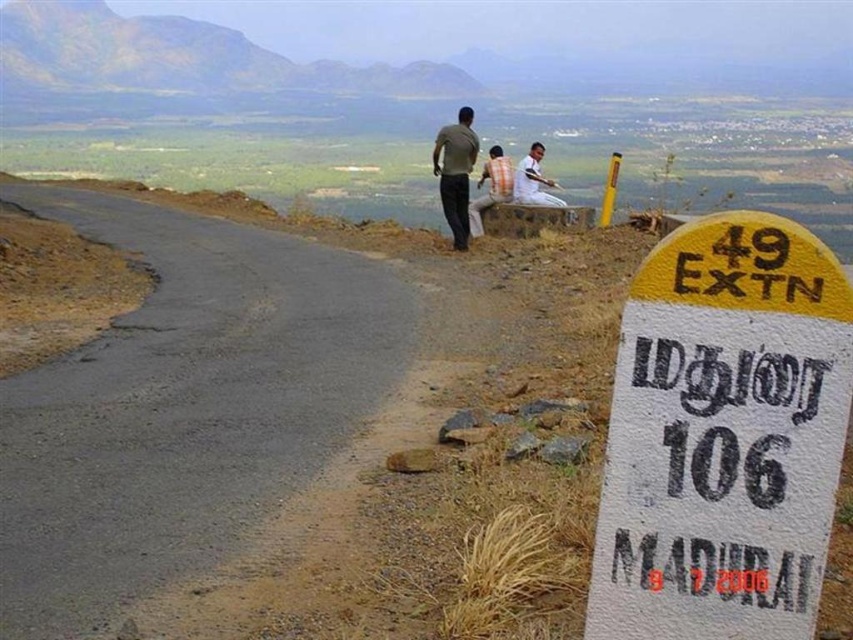
Question: Is black asphalt road at left further to the viewer compared to dark gray shirt at upper center?

Choices:
 (A) yes
 (B) no

Answer: (B)

Question: Which object is positioned closest to the orange striped shirt at center?

Choices:
 (A) black asphalt road at left
 (B) white painted stone sign at right
 (C) light brown wooden stick at upper center
 (D) dark gray shirt at upper center

Answer: (D)

Question: Which of the following is the closest to the observer?

Choices:
 (A) (228, 387)
 (B) (492, 196)
 (C) (523, 186)
 (D) (461, 163)

Answer: (A)

Question: Which of these objects is positioned closest to the orange striped shirt at center?

Choices:
 (A) dark gray shirt at upper center
 (B) white painted stone sign at right
 (C) black asphalt road at left
 (D) light brown wooden stick at upper center

Answer: (A)

Question: Is white painted stone sign at right positioned in front of orange striped shirt at center?

Choices:
 (A) yes
 (B) no

Answer: (A)

Question: Is white painted stone sign at right wider than dark gray shirt at upper center?

Choices:
 (A) yes
 (B) no

Answer: (A)